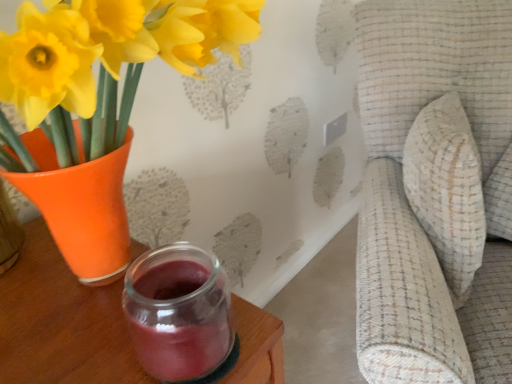
Describe the element at coordinates (61, 322) in the screenshot. The height and width of the screenshot is (384, 512). I see `transparent glass jar at lower center` at that location.

What do you see at coordinates (108, 61) in the screenshot?
I see `matte orange vase at left` at bounding box center [108, 61].

Identify the location of transparent glass jar at lower center. (61, 322).

Looking at the image, does transparent glass jar at lower center seem bigger or smaller compared to textured beige cushion at right?

transparent glass jar at lower center is smaller than textured beige cushion at right.

Is textured beige cushion at right surrounded by transparent glass jar at lower center?

No, transparent glass jar at lower center does not contain textured beige cushion at right.

Between transparent glass jar at lower center and textured beige cushion at right, which one has more height?

textured beige cushion at right is taller.

Between matte orange vase at left and textured beige cushion at right, which one has less height?

With less height is matte orange vase at left.

Is matte orange vase at left thinner than textured beige cushion at right?

Correct, the width of matte orange vase at left is less than that of textured beige cushion at right.

Is matte orange vase at left smaller than textured beige cushion at right?

Indeed, matte orange vase at left has a smaller size compared to textured beige cushion at right.

The height and width of the screenshot is (384, 512). I want to click on table on the left of textured beige cushion at right, so click(61, 322).

Based on the photo, considering the sizes of objects textured beige cushion at right and transparent glass jar at lower center in the image provided, who is thinner, textured beige cushion at right or transparent glass jar at lower center?

transparent glass jar at lower center.

Could you tell me if textured beige cushion at right is facing transparent glass jar at lower center?

No, textured beige cushion at right does not turn towards transparent glass jar at lower center.

Considering the relative sizes of textured beige cushion at right and transparent glass jar at lower center in the image provided, is textured beige cushion at right smaller than transparent glass jar at lower center?

Incorrect, textured beige cushion at right is not smaller in size than transparent glass jar at lower center.

From the image's perspective, would you say matte orange vase at left is positioned over transparent glass jar at lower center?

Yes, from the image's perspective, matte orange vase at left is over transparent glass jar at lower center.

Is matte orange vase at left facing towards transparent glass jar at lower center?

Yes.

Is matte orange vase at left shorter than transparent glass jar at lower center?

In fact, matte orange vase at left may be taller than transparent glass jar at lower center.

Is matte orange vase at left next to transparent glass jar at lower center?

matte orange vase at left is not next to transparent glass jar at lower center, and they're not touching.

Is textured beige cushion at right positioned far away from matte orange vase at left?

That's not correct — textured beige cushion at right is a little close to matte orange vase at left.

Is textured beige cushion at right taller than matte orange vase at left?

Correct, textured beige cushion at right is much taller as matte orange vase at left.

From a real-world perspective, is textured beige cushion at right above or below matte orange vase at left?

textured beige cushion at right is below matte orange vase at left.

Who is taller, transparent glass jar at lower center or matte orange vase at left?

matte orange vase at left.

Does transparent glass jar at lower center have a greater width compared to matte orange vase at left?

No.

You are a GUI agent. You are given a task and a screenshot of the screen. Output one action in this format:
    pyautogui.click(x=<x>, y=<y>)
    Task: Click on the table below the matte orange vase at left (from a real-world perspective)
    The image size is (512, 384).
    Given the screenshot: What is the action you would take?
    pyautogui.click(x=61, y=322)

The image size is (512, 384). I want to click on table on the left side of textured beige cushion at right, so click(x=61, y=322).

The image size is (512, 384). What are the coordinates of `swivel chair below the matte orange vase at left (from a real-world perspective)` in the screenshot? It's located at (434, 191).

From the image, which object appears to be farther from matte orange vase at left, transparent glass jar at lower center or textured beige cushion at right?

Based on the image, textured beige cushion at right appears to be further to matte orange vase at left.

Considering their positions, is transparent glass jar at lower center positioned further to textured beige cushion at right than matte orange vase at left?

matte orange vase at left lies further to textured beige cushion at right than the other object.

Which object lies nearer to the anchor point textured beige cushion at right, matte orange vase at left or transparent glass jar at lower center?

transparent glass jar at lower center lies closer to textured beige cushion at right than the other object.

Which object lies further to the anchor point transparent glass jar at lower center, matte orange vase at left or textured beige cushion at right?

textured beige cushion at right is positioned further to the anchor transparent glass jar at lower center.

Considering their positions, is textured beige cushion at right positioned further to matte orange vase at left than transparent glass jar at lower center?

textured beige cushion at right lies further to matte orange vase at left than the other object.

Looking at the image, which one is located further to transparent glass jar at lower center, textured beige cushion at right or matte orange vase at left?

Based on the image, textured beige cushion at right appears to be further to transparent glass jar at lower center.

This screenshot has width=512, height=384. Find the location of `table situated between matte orange vase at left and textured beige cushion at right from left to right`. table situated between matte orange vase at left and textured beige cushion at right from left to right is located at coordinates 61,322.